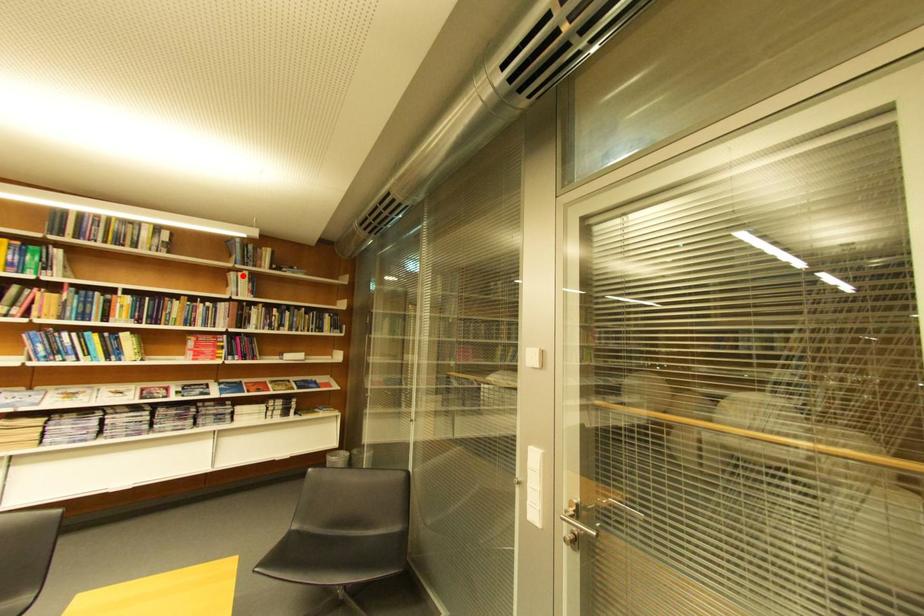
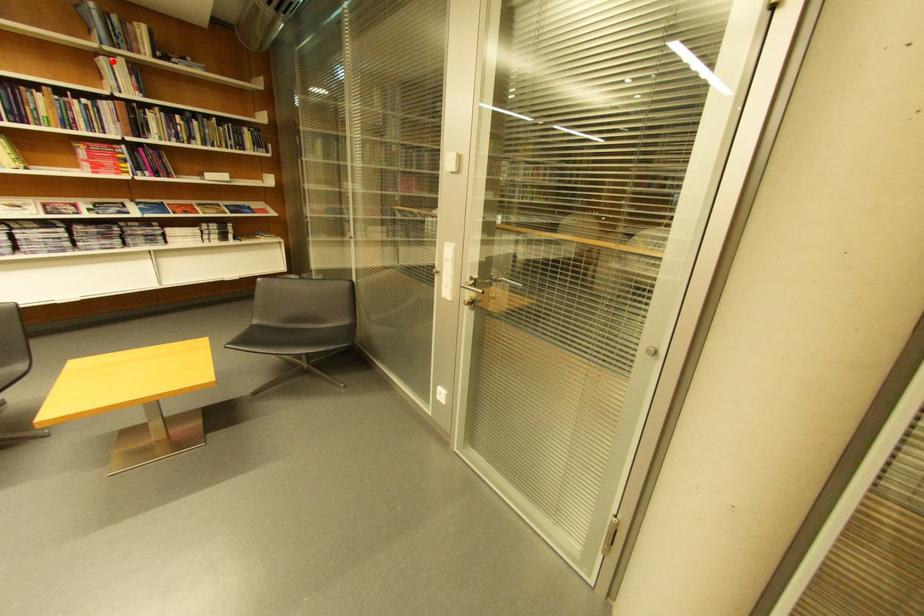
I am providing you with two images of the same scene from different viewpoints. A red point is marked on the first image and another point is marked on the second image. Is the marked point in image1 the same physical position as the marked point in image2?

Yes